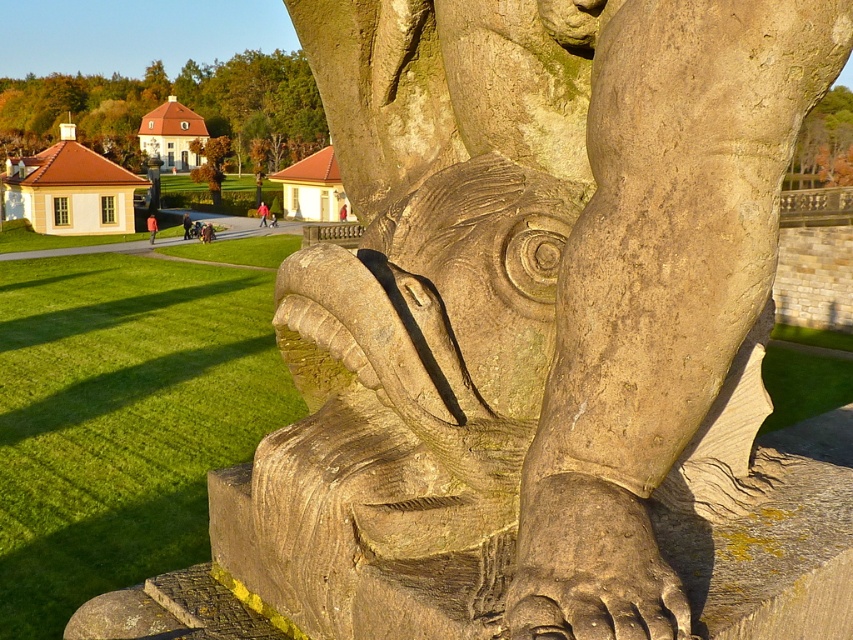
You are standing in a park and see the green leafy tree at upper center and the brown rough bark at upper right. Which one is taller?

The green leafy tree at upper center is shorter than the brown rough bark at upper right, so the brown rough bark at upper right is taller.

You are planning to install a new bench between the green leafy tree at upper center and the brown rough bark at upper right. The bench requires a minimum of 20 meters of space between the two objects to be placed safely. Can the bench be installed in this location?

The green leafy tree at upper center and brown rough bark at upper right are 22.37 meters apart from each other, which exceeds the required 20 meters. Therefore, the bench can be safely installed between them.